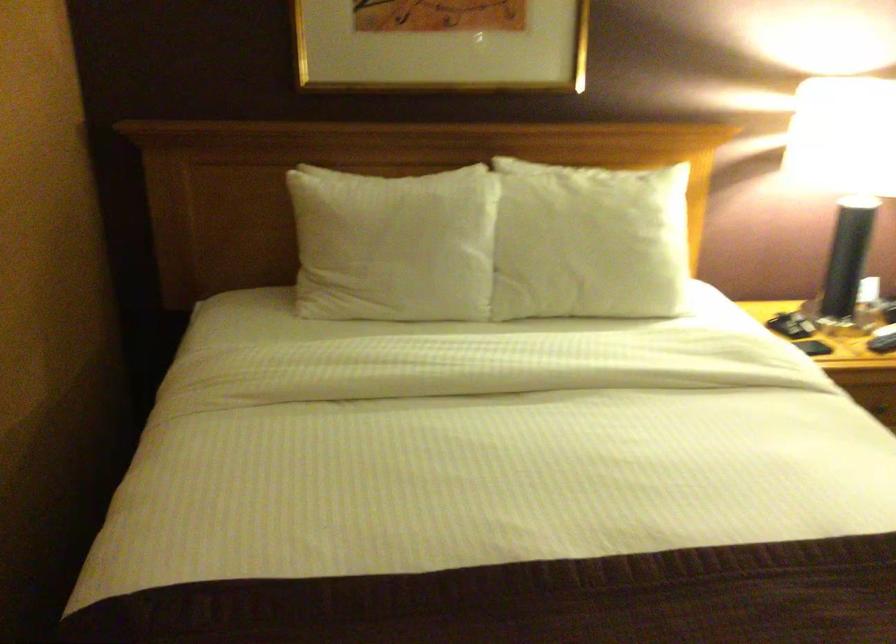
The height and width of the screenshot is (644, 896). Identify the location of phone handset. 782,325.